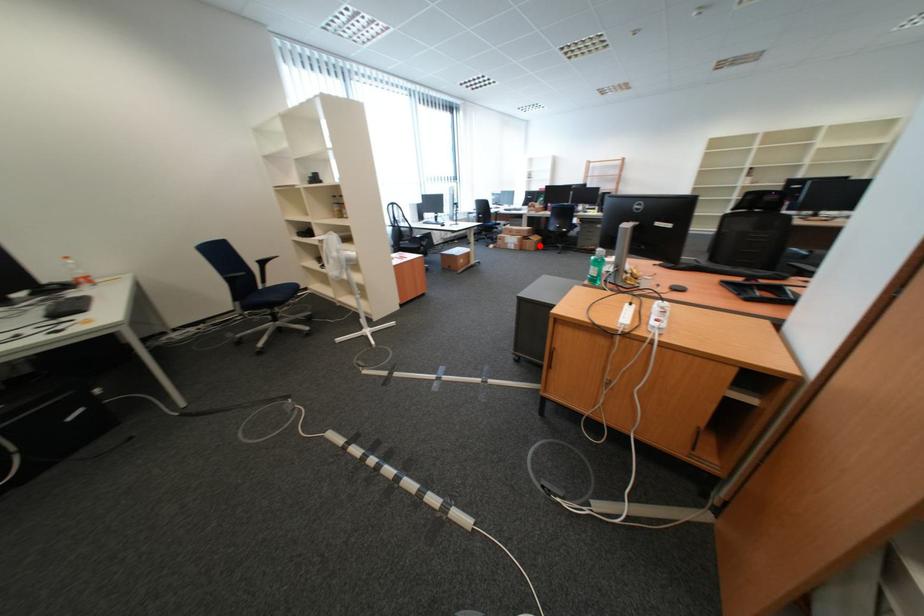
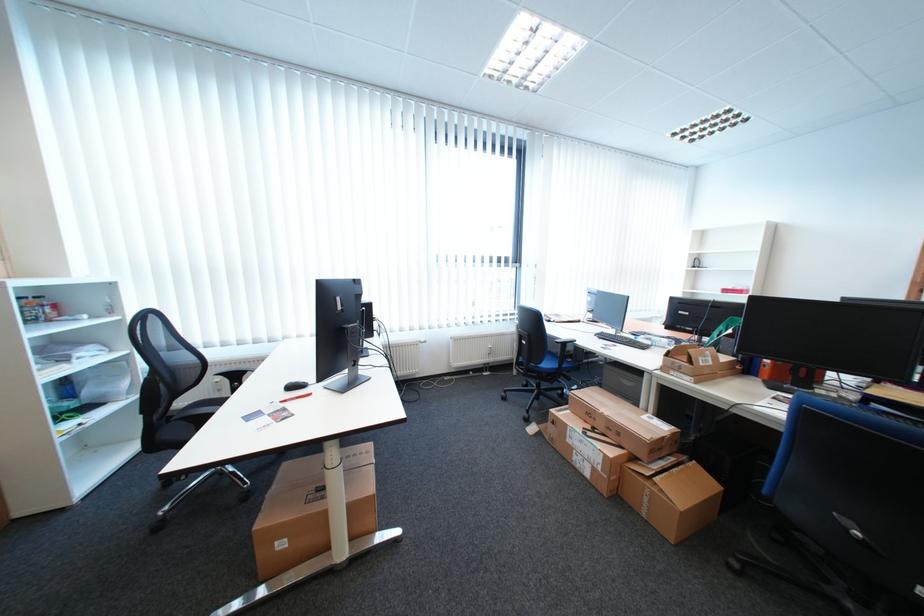
Where in the second image is the point corresponding to the highlighted location from the first image?

(658, 499)